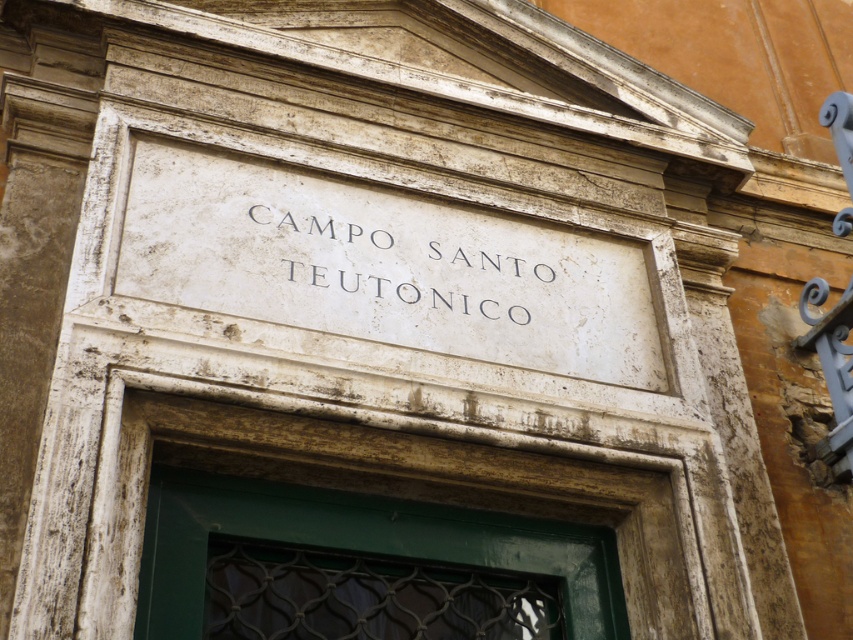
Can you confirm if white marble sign at center is bigger than white stone sign at center?

Yes, white marble sign at center is bigger than white stone sign at center.

Does white marble sign at center appear over white stone sign at center?

No.

Between point (293, 216) and point (294, 264), which one is positioned behind?

Positioned behind is point (293, 216).

This screenshot has width=853, height=640. Find the location of `white marble sign at center`. white marble sign at center is located at coordinates (384, 266).